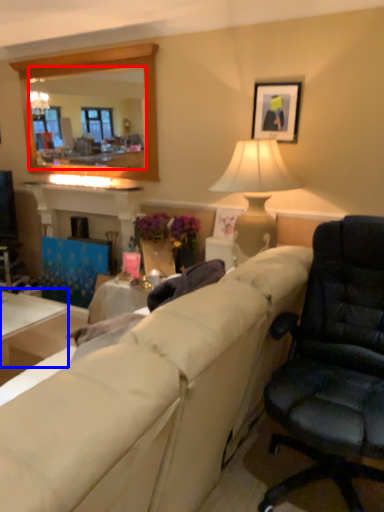
Question: Which of the following is the closest to the observer, mirror (highlighted by a red box) or table (highlighted by a blue box)?

Choices:
 (A) mirror
 (B) table

Answer: (B)